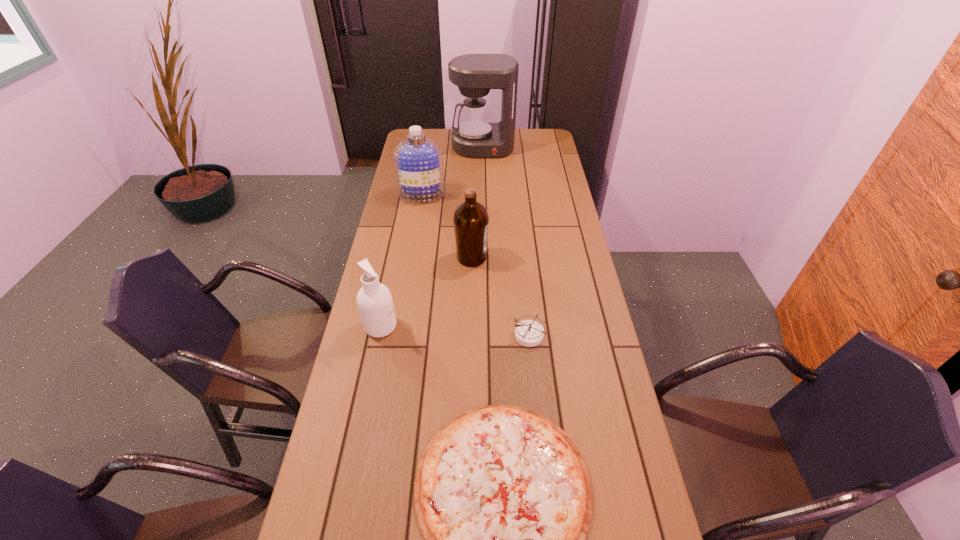
Where is `the tallest object`? the tallest object is located at coordinates pyautogui.click(x=476, y=136).

This screenshot has width=960, height=540. What are the coordinates of `coffee maker` in the screenshot? It's located at (476, 136).

Find the location of `the second farthest object`. the second farthest object is located at coordinates (419, 169).

Identify the location of the taller cleansing agent. (419, 169).

Where is `the fourth nearest object`? the fourth nearest object is located at coordinates (471, 220).

At what (x,y) coordinates should I click in order to perform the action: click on the shorter cleansing agent. Please return your answer as a coordinate pair (x, y). The image size is (960, 540). Looking at the image, I should click on (374, 300).

Find the location of a particular element. The height and width of the screenshot is (540, 960). the second shortest object is located at coordinates [x=529, y=333].

You are a GUI agent. You are given a task and a screenshot of the screen. Output one action in this format:
    pyautogui.click(x=<x>, y=<y>)
    Task: Click on the vacant region located on the button side of the tallest object
    This screenshot has width=960, height=540.
    Given the screenshot: What is the action you would take?
    pyautogui.click(x=483, y=171)

Identify the location of vacant region located 0.080m on the front of the farther cleansing agent. (419, 217).

The image size is (960, 540). Find the location of `vacant region located 0.280m on the label of the olive oil`. vacant region located 0.280m on the label of the olive oil is located at coordinates (565, 258).